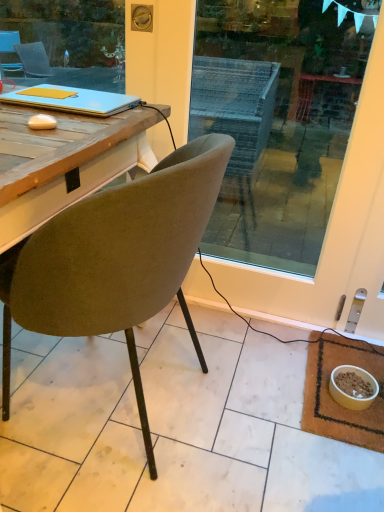
Image resolution: width=384 pixels, height=512 pixels. I want to click on vacant space to the left of yellow matte bowl at lower right, so click(310, 397).